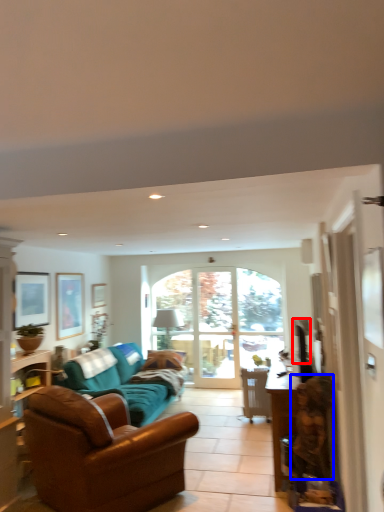
Question: Which object is closer to the camera taking this photo, television (highlighted by a red box) or person (highlighted by a blue box)?

Choices:
 (A) television
 (B) person

Answer: (B)